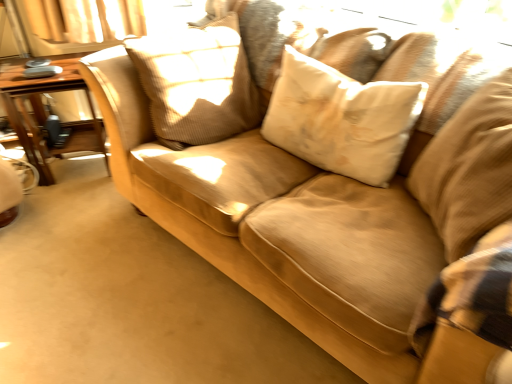
What do you see at coordinates (46, 112) in the screenshot? Image resolution: width=512 pixels, height=384 pixels. I see `wooden table at left` at bounding box center [46, 112].

In order to click on beige fabric pillow at right, which appears as the third pillow when viewed from the left in this screenshot , I will do `click(469, 169)`.

From the image's perspective, does wooden table at left appear higher than beige textured pillow at center, the 1th pillow from the left?

No.

Which is closer to the camera, (x=69, y=90) or (x=176, y=65)?

The point (x=176, y=65) is in front.

Does wooden table at left touch beige textured pillow at center, the 1th pillow from the left?

→ No.

Is wooden table at left inside the boundaries of beige textured pillow at center, the 1th pillow from the left, or outside?

wooden table at left is outside beige textured pillow at center, the 1th pillow from the left.

At what (x,y) coordinates should I click in order to perform the action: click on the 1st pillow below the wooden table at left (from the image's perspective). Please return your answer as a coordinate pair (x, y). This screenshot has height=384, width=512. Looking at the image, I should click on (341, 119).

Considering the sizes of objects white soft pillow at center, arranged as the 2th pillow when viewed from the left, and wooden table at left in the image provided, who is thinner, white soft pillow at center, arranged as the 2th pillow when viewed from the left, or wooden table at left?

white soft pillow at center, arranged as the 2th pillow when viewed from the left.

From the image's perspective, who appears lower, white soft pillow at center, arranged as the 2th pillow when viewed from the left, or wooden table at left?

white soft pillow at center, arranged as the 2th pillow when viewed from the left, is shown below in the image.

Is white soft pillow at center, arranged as the 2th pillow when viewed from the right, spatially inside wooden table at left, or outside of it?

white soft pillow at center, arranged as the 2th pillow when viewed from the right, is spatially situated outside wooden table at left.

Considering the points (478, 153) and (46, 142), which point is in front, point (478, 153) or point (46, 142)?

The point (478, 153) is closer to the camera.

In the scene shown: Is beige fabric pillow at right, which is counted as the first pillow, starting from the right, turned away from wooden table at left?

beige fabric pillow at right, which is counted as the first pillow, starting from the right, does not have its back to wooden table at left.

Consider the image. Is beige fabric pillow at right, which is counted as the first pillow, starting from the right, not inside wooden table at left?

beige fabric pillow at right, which is counted as the first pillow, starting from the right, is positioned outside wooden table at left.

Based on their positions, is beige fabric pillow at right, which is counted as the first pillow, starting from the right, located to the left or right of wooden table at left?

beige fabric pillow at right, which is counted as the first pillow, starting from the right, is positioned on wooden table at left's right side.

From the image's perspective, is white soft pillow at center, arranged as the 2th pillow when viewed from the right, above beige textured pillow at center, the third pillow from the right?

No, from the image's perspective, white soft pillow at center, arranged as the 2th pillow when viewed from the right, is not on top of beige textured pillow at center, the third pillow from the right.

Does white soft pillow at center, arranged as the 2th pillow when viewed from the left, have a lesser width compared to beige textured pillow at center, the 1th pillow from the left?

Indeed, white soft pillow at center, arranged as the 2th pillow when viewed from the left, has a lesser width compared to beige textured pillow at center, the 1th pillow from the left.

Consider the image. Is white soft pillow at center, arranged as the 2th pillow when viewed from the right, positioned far away from beige textured pillow at center, the 1th pillow from the left?

That's not correct — white soft pillow at center, arranged as the 2th pillow when viewed from the right, is a little close to beige textured pillow at center, the 1th pillow from the left.

From a real-world perspective, between white soft pillow at center, arranged as the 2th pillow when viewed from the right, and beige textured pillow at center, the 1th pillow from the left, who is vertically lower?

From a 3D spatial view, white soft pillow at center, arranged as the 2th pillow when viewed from the right, is below.

Is beige textured pillow at center, the third pillow from the right, wider or thinner than beige fabric pillow at right, which appears as the third pillow when viewed from the left?

Considering their sizes, beige textured pillow at center, the third pillow from the right, looks slimmer than beige fabric pillow at right, which appears as the third pillow when viewed from the left.

Which is closer to the camera, (225, 91) or (493, 146)?

Point (225, 91) appears to be farther away from the viewer than point (493, 146).

Is beige textured pillow at center, the 1th pillow from the left, oriented towards beige fabric pillow at right, which is counted as the first pillow, starting from the right?

Yes, beige textured pillow at center, the 1th pillow from the left, is aimed at beige fabric pillow at right, which is counted as the first pillow, starting from the right.

Can you confirm if beige textured pillow at center, the third pillow from the right, is positioned to the right of wooden table at left?

Yes, beige textured pillow at center, the third pillow from the right, is to the right of wooden table at left.

Find the location of a particular element. table directly beneath the beige textured pillow at center, the third pillow from the right (from a real-world perspective) is located at coordinates click(x=46, y=112).

From the image's perspective, which one is positioned higher, beige textured pillow at center, the 1th pillow from the left, or wooden table at left?

beige textured pillow at center, the 1th pillow from the left.

Considering the sizes of objects beige fabric pillow at right, which is counted as the first pillow, starting from the right, and beige textured pillow at center, the 1th pillow from the left, in the image provided, who is thinner, beige fabric pillow at right, which is counted as the first pillow, starting from the right, or beige textured pillow at center, the 1th pillow from the left,?

With smaller width is beige textured pillow at center, the 1th pillow from the left.

Is beige fabric pillow at right, which appears as the third pillow when viewed from the left, positioned far away from beige textured pillow at center, the 1th pillow from the left?

No, beige fabric pillow at right, which appears as the third pillow when viewed from the left, is not far from beige textured pillow at center, the 1th pillow from the left.

In the scene shown: Does beige fabric pillow at right, which appears as the third pillow when viewed from the left, have a greater height compared to beige textured pillow at center, the third pillow from the right?

Yes.

This screenshot has width=512, height=384. What are the coordinates of `table directly beneath the beige textured pillow at center, the third pillow from the right (from a real-world perspective)` in the screenshot? It's located at (46, 112).

Starting from the wooden table at left, which pillow is the 2nd one in front? Please provide its 2D coordinates.

[(341, 119)]

Estimate the real-world distances between objects in this image. Which object is closer to white soft pillow at center, arranged as the 2th pillow when viewed from the right, beige textured pillow at center, the 1th pillow from the left, or wooden table at left?

beige textured pillow at center, the 1th pillow from the left, lies closer to white soft pillow at center, arranged as the 2th pillow when viewed from the right, than the other object.

Based on their spatial positions, is wooden table at left or white soft pillow at center, arranged as the 2th pillow when viewed from the right, closer to beige fabric pillow at right, which is counted as the first pillow, starting from the right?

Based on the image, white soft pillow at center, arranged as the 2th pillow when viewed from the right, appears to be nearer to beige fabric pillow at right, which is counted as the first pillow, starting from the right.

From the image, which object appears to be nearer to beige fabric pillow at right, which appears as the third pillow when viewed from the left, white soft pillow at center, arranged as the 2th pillow when viewed from the left, or beige textured pillow at center, the 1th pillow from the left?

white soft pillow at center, arranged as the 2th pillow when viewed from the left, lies closer to beige fabric pillow at right, which appears as the third pillow when viewed from the left, than the other object.

Looking at this image, which object lies further to the anchor point beige fabric pillow at right, which is counted as the first pillow, starting from the right, white soft pillow at center, arranged as the 2th pillow when viewed from the right, or wooden table at left?

The object further to beige fabric pillow at right, which is counted as the first pillow, starting from the right, is wooden table at left.

Which object lies nearer to the anchor point beige textured pillow at center, the third pillow from the right, beige fabric pillow at right, which is counted as the first pillow, starting from the right, or white soft pillow at center, arranged as the 2th pillow when viewed from the left?

white soft pillow at center, arranged as the 2th pillow when viewed from the left.

Which object lies further to the anchor point beige textured pillow at center, the 1th pillow from the left, beige fabric pillow at right, which appears as the third pillow when viewed from the left, or wooden table at left?

beige fabric pillow at right, which appears as the third pillow when viewed from the left, lies further to beige textured pillow at center, the 1th pillow from the left, than the other object.

Considering their positions, is beige textured pillow at center, the third pillow from the right, positioned further to wooden table at left than beige fabric pillow at right, which is counted as the first pillow, starting from the right?

The object further to wooden table at left is beige fabric pillow at right, which is counted as the first pillow, starting from the right.

Based on their spatial positions, is white soft pillow at center, arranged as the 2th pillow when viewed from the right, or beige fabric pillow at right, which appears as the third pillow when viewed from the left, closer to beige textured pillow at center, the 1th pillow from the left?

Among the two, white soft pillow at center, arranged as the 2th pillow when viewed from the right, is located nearer to beige textured pillow at center, the 1th pillow from the left.

What are the coordinates of `pillow between beige textured pillow at center, the third pillow from the right, and beige fabric pillow at right, which is counted as the first pillow, starting from the right, in the horizontal direction` in the screenshot? It's located at 341,119.

Locate an element on the screen. This screenshot has height=384, width=512. pillow between wooden table at left and white soft pillow at center, arranged as the 2th pillow when viewed from the right, from left to right is located at coordinates pos(197,83).